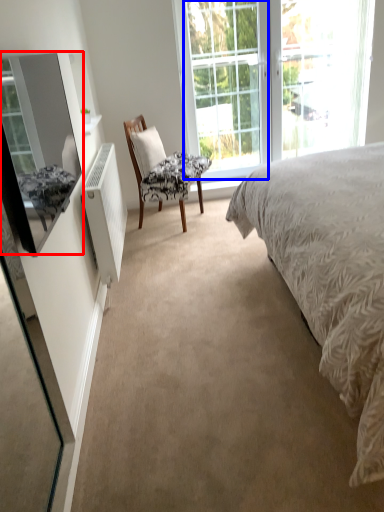
Question: Among these objects, which one is nearest to the camera, mirror (highlighted by a red box) or glass door (highlighted by a blue box)?

Choices:
 (A) mirror
 (B) glass door

Answer: (A)